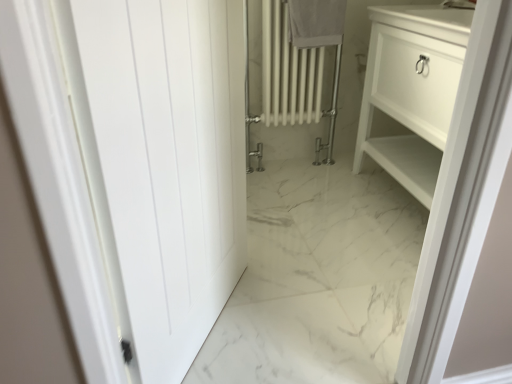
This screenshot has height=384, width=512. I want to click on vacant area that lies to the right of white matte door at left, so click(304, 319).